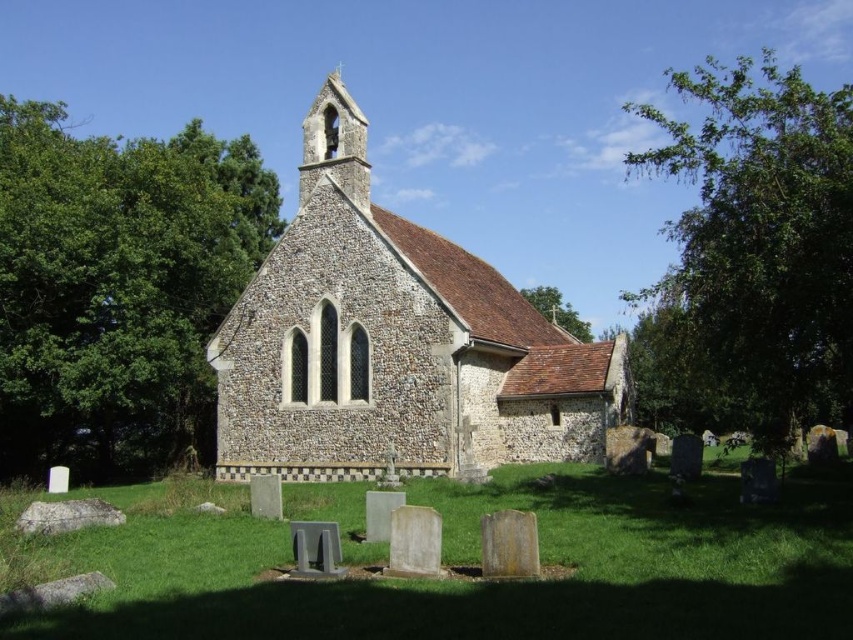
Question: Which object is positioned closest to the brown stone church at center?

Choices:
 (A) green leafy tree at upper right
 (B) green leafy tree at upper left
 (C) brown shingles roof at upper center

Answer: (B)

Question: Can you confirm if green leafy tree at upper left is positioned below brown shingles roof at upper center?

Choices:
 (A) yes
 (B) no

Answer: (B)

Question: Considering the real-world distances, which object is closest to the brown stone church at center?

Choices:
 (A) green leafy tree at upper left
 (B) brown shingles roof at upper center

Answer: (A)

Question: Is brown stone church at center to the left of brown shingles roof at upper center from the viewer's perspective?

Choices:
 (A) no
 (B) yes

Answer: (B)

Question: Can you confirm if brown stone church at center is positioned below green leafy tree at upper left?

Choices:
 (A) no
 (B) yes

Answer: (B)

Question: Which point is farther to the camera?

Choices:
 (A) green leafy tree at upper right
 (B) brown stone church at center
 (C) green leafy tree at upper left
 (D) brown shingles roof at upper center

Answer: (D)